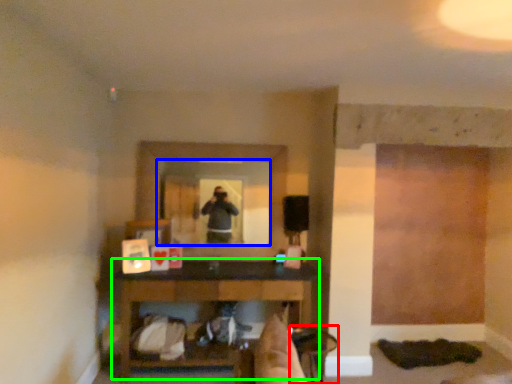
Question: Which object is positioned farthest from chair (highlighted by a red box)? Select from mirror (highlighted by a blue box) and table (highlighted by a green box).

Choices:
 (A) mirror
 (B) table

Answer: (A)